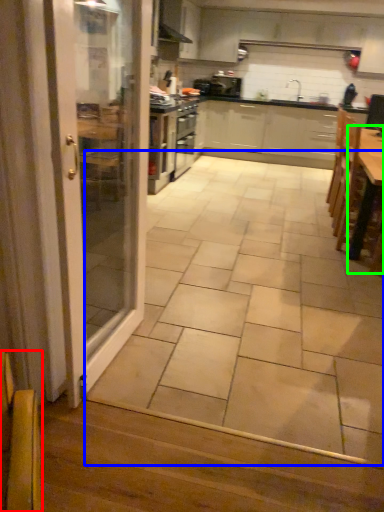
Question: Considering the real-world distances, which object is farthest from armchair (highlighted by a red box)? ceramic tile (highlighted by a blue box) or table (highlighted by a green box)?

Choices:
 (A) ceramic tile
 (B) table

Answer: (B)